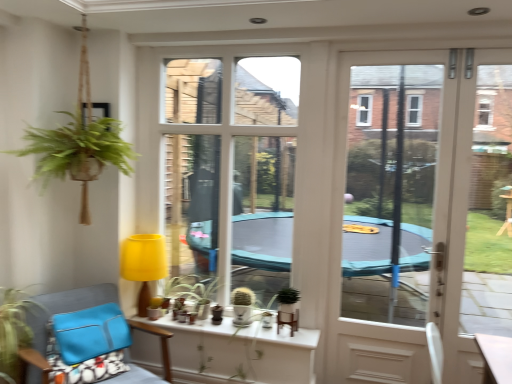
The image size is (512, 384). What do you see at coordinates (288, 296) in the screenshot? I see `green matte plant at center` at bounding box center [288, 296].

This screenshot has width=512, height=384. Identify the location of blue fabric chair at lower left. (56, 313).

The width and height of the screenshot is (512, 384). In order to click on white ceramic pots at center in this screenshot , I will do `click(240, 352)`.

Identify the location of green matte plant at center. The image size is (512, 384). (288, 296).

Is green matte plant at lower left, which is the first houseplant in left-to-right order, to the right of white glass door at right from the viewer's perspective?

In fact, green matte plant at lower left, which is the first houseplant in left-to-right order, is to the left of white glass door at right.

From a real-world perspective, who is located lower, green matte plant at lower left, the 2th houseplant viewed from the back, or white glass door at right?

green matte plant at lower left, the 2th houseplant viewed from the back, from a real-world perspective.

Considering the relative sizes of green matte plant at lower left, arranged as the 1th houseplant when viewed from the front, and white glass door at right in the image provided, is green matte plant at lower left, arranged as the 1th houseplant when viewed from the front, thinner than white glass door at right?

Incorrect, the width of green matte plant at lower left, arranged as the 1th houseplant when viewed from the front, is not less than that of white glass door at right.

Based on the photo, how much distance is there between green matte plant at lower left, the 2th houseplant viewed from the back, and white glass door at right?

green matte plant at lower left, the 2th houseplant viewed from the back, and white glass door at right are 2.21 meters apart from each other.

Would you say white ceramic pots at center is a long distance from matte white cactus at center, positioned as the first houseplant in back-to-front order?

white ceramic pots at center is actually quite close to matte white cactus at center, positioned as the first houseplant in back-to-front order.

Can you confirm if white ceramic pots at center is wider than matte white cactus at center, which is the 2th houseplant in left-to-right order?

Yes, white ceramic pots at center is wider than matte white cactus at center, which is the 2th houseplant in left-to-right order.

Which is correct: white ceramic pots at center is inside matte white cactus at center, which is the 2th houseplant in left-to-right order, or outside of it?

The correct answer is: outside.

What's the angular difference between white ceramic pots at center and matte white cactus at center, which is the 2th houseplant in left-to-right order,'s facing directions?

The angle between the facing direction of white ceramic pots at center and the facing direction of matte white cactus at center, which is the 2th houseplant in left-to-right order, is 0.631 degrees.

From the image's perspective, who appears lower, green matte plant at center or matte yellow lampshade at center?

From the image's view, green matte plant at center is below.

At what (x,y) coordinates should I click in order to perform the action: click on plant on the right of the matte yellow lampshade at center. Please return your answer as a coordinate pair (x, y). Looking at the image, I should click on (288, 296).

Considering their positions, is green matte plant at center located in front of or behind matte yellow lampshade at center?

Visually, green matte plant at center is located in front of matte yellow lampshade at center.

Is matte yellow lampshade at center shorter than green matte plant at lower left, which is the first houseplant in left-to-right order?

No.

What's the angular difference between matte yellow lampshade at center and green matte plant at lower left, the second houseplant viewed from the right,'s facing directions?

They differ by 91.2 degrees in their facing directions.

From the picture: Is matte yellow lampshade at center thinner than green matte plant at lower left, which is the first houseplant in left-to-right order?

Yes, matte yellow lampshade at center is thinner than green matte plant at lower left, which is the first houseplant in left-to-right order.

Which is closer to the camera, (157,253) or (16,343)?

Point (157,253) is farther from the camera than point (16,343).

Are blue fabric chair at lower left and matte yellow lampshade at center far apart?

That's not correct — blue fabric chair at lower left is a little close to matte yellow lampshade at center.

From the image's perspective, does blue fabric chair at lower left appear lower than matte yellow lampshade at center?

Indeed, from the image's perspective, blue fabric chair at lower left is shown beneath matte yellow lampshade at center.

Is the depth of blue fabric chair at lower left greater than that of matte yellow lampshade at center?

No, blue fabric chair at lower left is closer to the camera.

Does blue fabric chair at lower left appear on the left side of matte yellow lampshade at center?

Correct, you'll find blue fabric chair at lower left to the left of matte yellow lampshade at center.

From the image's perspective, which is above, blue fabric chair at lower left or matte white cactus at center, which is the first houseplant in right-to-left order?

matte white cactus at center, which is the first houseplant in right-to-left order, is shown above in the image.

Considering the relative sizes of blue fabric chair at lower left and matte white cactus at center, which is the 2th houseplant in left-to-right order, in the image provided, is blue fabric chair at lower left bigger than matte white cactus at center, which is the 2th houseplant in left-to-right order,?

Yes, blue fabric chair at lower left is bigger than matte white cactus at center, which is the 2th houseplant in left-to-right order.

From a real-world perspective, is blue fabric chair at lower left physically above matte white cactus at center, positioned as the first houseplant in back-to-front order?

No, from a real-world perspective, blue fabric chair at lower left is not above matte white cactus at center, positioned as the first houseplant in back-to-front order.

There is a blue fabric chair at lower left. Where is `the 2nd houseplant above it (from a real-world perspective)`? the 2nd houseplant above it (from a real-world perspective) is located at coordinates (242, 306).

Is white glass door at right looking in the opposite direction of transparent plastic window screen at center?

No, transparent plastic window screen at center is not at the back of white glass door at right.

Which is correct: white glass door at right is inside transparent plastic window screen at center, or outside of it?

white glass door at right cannot be found inside transparent plastic window screen at center.

From the image's perspective, is white glass door at right over transparent plastic window screen at center?

No, from the image's perspective, white glass door at right is not on top of transparent plastic window screen at center.

Does white glass door at right touch transparent plastic window screen at center?

No, white glass door at right is not in contact with transparent plastic window screen at center.

The image size is (512, 384). In order to click on door that appears above the green matte plant at lower left, which is the first houseplant in left-to-right order (from the image's perspective) in this screenshot , I will do `click(423, 210)`.

Find the location of `houseplant behind the white ceramic pots at center`. houseplant behind the white ceramic pots at center is located at coordinates (242, 306).

Based on their spatial positions, is matte yellow lampshade at center or green matte plant at lower left, the second houseplant viewed from the right, further from white glass door at right?

Based on the image, green matte plant at lower left, the second houseplant viewed from the right, appears to be further to white glass door at right.

Considering their positions, is transparent plastic window screen at center positioned further to blue fabric chair at lower left than green matte plant at lower left, which is the first houseplant in left-to-right order?

Based on the image, transparent plastic window screen at center appears to be further to blue fabric chair at lower left.

Which object lies further to the anchor point white glass door at right, green matte plant at center or blue fabric chair at lower left?

blue fabric chair at lower left is positioned further to the anchor white glass door at right.

From the image, which object appears to be farther from matte yellow lampshade at center, matte white cactus at center, positioned as the first houseplant in back-to-front order, or green matte plant at center?

green matte plant at center is further to matte yellow lampshade at center.

Considering their positions, is green matte plant at center positioned closer to transparent plastic window screen at center than matte white cactus at center, which is the 2th houseplant in left-to-right order?

Among the two, matte white cactus at center, which is the 2th houseplant in left-to-right order, is located nearer to transparent plastic window screen at center.

Estimate the real-world distances between objects in this image. Which object is further from transparent plastic window screen at center, matte yellow lampshade at center or white ceramic pots at center?

The object further to transparent plastic window screen at center is white ceramic pots at center.

When comparing their distances from matte white cactus at center, which is the 2th houseplant in left-to-right order, does white ceramic pots at center or white glass door at right seem closer?

Among the two, white ceramic pots at center is located nearer to matte white cactus at center, which is the 2th houseplant in left-to-right order.

Which object lies further to the anchor point white ceramic pots at center, green matte plant at lower left, the 2th houseplant viewed from the back, or transparent plastic window screen at center?

The object further to white ceramic pots at center is transparent plastic window screen at center.

You are a GUI agent. You are given a task and a screenshot of the screen. Output one action in this format:
    pyautogui.click(x=<x>, y=<y>)
    Task: Click on the lamp between blue fabric chair at lower left and green matte plant at center from left to right
    The image size is (512, 384).
    Given the screenshot: What is the action you would take?
    pos(144,264)

Find the location of a particular element. Image resolution: width=512 pixels, height=384 pixels. window screen between matte yellow lampshade at center and white glass door at right from left to right is located at coordinates (233, 166).

In order to click on lamp located between green matte plant at lower left, which is the first houseplant in left-to-right order, and white glass door at right in the left-right direction in this screenshot , I will do `click(144, 264)`.

You are a GUI agent. You are given a task and a screenshot of the screen. Output one action in this format:
    pyautogui.click(x=<x>, y=<y>)
    Task: Click on the lamp between green matte plant at lower left, arranged as the 1th houseplant when viewed from the front, and transparent plastic window screen at center, in the horizontal direction
    The width and height of the screenshot is (512, 384).
    Given the screenshot: What is the action you would take?
    pyautogui.click(x=144, y=264)